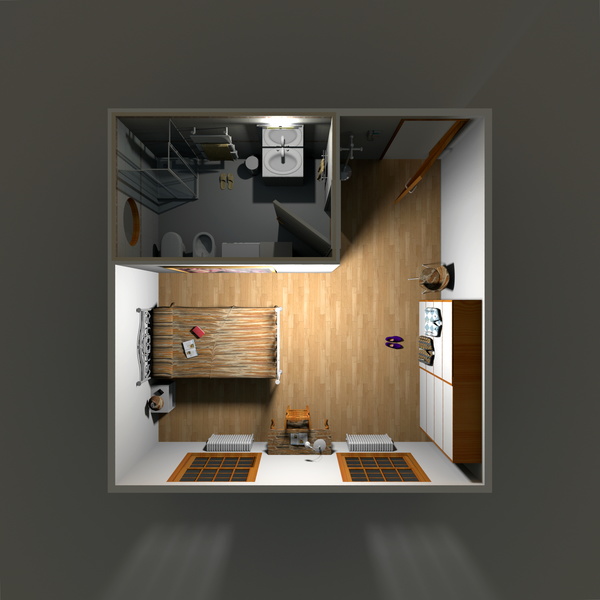
The height and width of the screenshot is (600, 600). What are the coordinates of `window` in the screenshot? It's located at (128, 222).